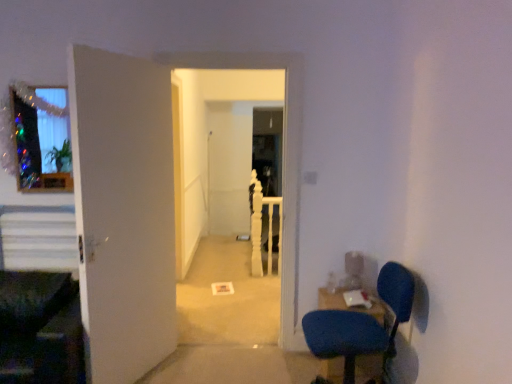
Question: Should I look upward or downward to see white striped stairs at left?

Choices:
 (A) up
 (B) down

Answer: (B)

Question: Does translucent glass window at upper left have a smaller size compared to white striped stairs at left?

Choices:
 (A) no
 (B) yes

Answer: (B)

Question: Is translucent glass window at upper left next to white striped stairs at left and touching it?

Choices:
 (A) no
 (B) yes

Answer: (A)

Question: Is translucent glass window at upper left not inside white striped stairs at left?

Choices:
 (A) yes
 (B) no

Answer: (A)

Question: Does translucent glass window at upper left have a greater width compared to white striped stairs at left?

Choices:
 (A) yes
 (B) no

Answer: (B)

Question: From a real-world perspective, is translucent glass window at upper left located higher than white striped stairs at left?

Choices:
 (A) no
 (B) yes

Answer: (B)

Question: From the image's perspective, is translucent glass window at upper left below white striped stairs at left?

Choices:
 (A) yes
 (B) no

Answer: (B)

Question: Is blue fabric chair at lower right completely or partially inside white striped stairs at left?

Choices:
 (A) no
 (B) yes

Answer: (A)

Question: Considering the relative sizes of white striped stairs at left and blue fabric chair at lower right in the image provided, is white striped stairs at left bigger than blue fabric chair at lower right?

Choices:
 (A) no
 (B) yes

Answer: (A)

Question: From the image's perspective, is white striped stairs at left on top of blue fabric chair at lower right?

Choices:
 (A) no
 (B) yes

Answer: (B)

Question: Considering the relative positions of white striped stairs at left and blue fabric chair at lower right in the image provided, is white striped stairs at left to the left of blue fabric chair at lower right from the viewer's perspective?

Choices:
 (A) yes
 (B) no

Answer: (A)

Question: Is white striped stairs at left taller than blue fabric chair at lower right?

Choices:
 (A) yes
 (B) no

Answer: (B)

Question: From a real-world perspective, is white striped stairs at left physically below blue fabric chair at lower right?

Choices:
 (A) yes
 (B) no

Answer: (B)

Question: Is the depth of blue fabric chair at lower right greater than that of white wooden rail at center?

Choices:
 (A) yes
 (B) no

Answer: (B)